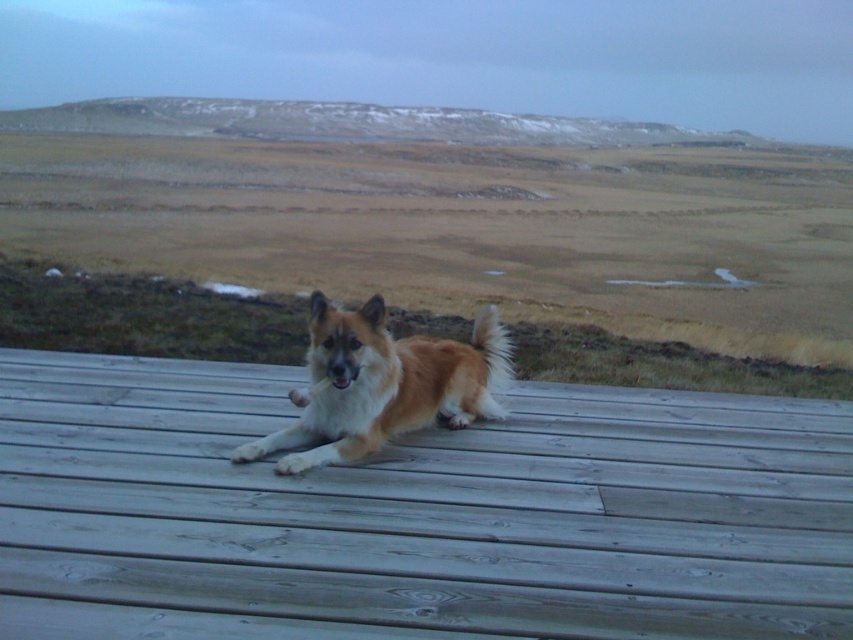
Looking at this image, you are designing a new pet bed for the brown fur dog at center. The bed needs to be placed on the wooden deck at center. Based on the deck and dog dimensions, will the bed fit if it is the same size as the dog?

The wooden deck at center is thinner than the brown fur dog at center, so a bed the same size as the dog may not fit entirely on the deck since the deck is narrower than the dog.

You are standing on the wooden deck at center and want to see the golden fur dog at center. In which direction should you look?

The wooden deck at center is to the left of golden fur dog at center, so you should look to your right to see the golden fur dog at center.

You are standing at the point marked as point (415, 515) in the image. What is directly beneath your feet?

The point (415, 515) corresponds to the wooden deck at center, so the wooden deck at center is directly beneath your feet.